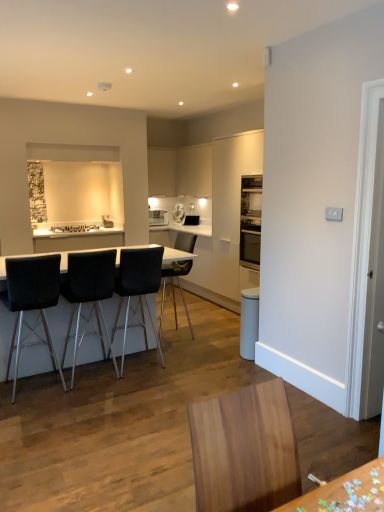
Question: Does black leather chair at center, placed as the 2th chair when sorted from right to left, have a greater width compared to black fabric chair at left, which is the first chair from left to right?

Choices:
 (A) yes
 (B) no

Answer: (B)

Question: Is black fabric chair at left, which is the first chair from left to right, at the back of black leather chair at center, the third chair positioned from the left?

Choices:
 (A) yes
 (B) no

Answer: (B)

Question: Is black leather chair at center, placed as the 2th chair when sorted from right to left, outside of black fabric chair at left, the fourth chair in the right-to-left sequence?

Choices:
 (A) yes
 (B) no

Answer: (A)

Question: Can you confirm if black leather chair at center, placed as the 2th chair when sorted from right to left, is smaller than black fabric chair at left, which is the first chair from left to right?

Choices:
 (A) yes
 (B) no

Answer: (A)

Question: Is black leather chair at center, the third chair positioned from the left, to the right of black fabric chair at left, which is the first chair from left to right, from the viewer's perspective?

Choices:
 (A) yes
 (B) no

Answer: (A)

Question: Is black leather chair at center, placed as the 2th chair when sorted from right to left, closer to camera compared to black fabric chair at left, which is the first chair from left to right?

Choices:
 (A) yes
 (B) no

Answer: (B)

Question: Is the position of black leather chair at center, which ranks as the 1th chair in right-to-left order, more distant than that of black fabric chair at left, which is the first chair from left to right?

Choices:
 (A) no
 (B) yes

Answer: (B)

Question: Considering the relative sizes of black leather chair at center, marked as the fourth chair in a left-to-right arrangement, and black fabric chair at left, which is the first chair from left to right, in the image provided, is black leather chair at center, marked as the fourth chair in a left-to-right arrangement, bigger than black fabric chair at left, which is the first chair from left to right,?

Choices:
 (A) no
 (B) yes

Answer: (A)

Question: Can you see black leather chair at center, marked as the fourth chair in a left-to-right arrangement, touching black fabric chair at left, the fourth chair in the right-to-left sequence?

Choices:
 (A) no
 (B) yes

Answer: (A)

Question: Does black leather chair at center, marked as the fourth chair in a left-to-right arrangement, have a greater width compared to black fabric chair at left, the fourth chair in the right-to-left sequence?

Choices:
 (A) no
 (B) yes

Answer: (A)

Question: From a real-world perspective, is black leather chair at center, marked as the fourth chair in a left-to-right arrangement, on black fabric chair at left, which is the first chair from left to right?

Choices:
 (A) no
 (B) yes

Answer: (A)

Question: From a real-world perspective, is black leather chair at center, which ranks as the 1th chair in right-to-left order, located beneath black fabric chair at left, the fourth chair in the right-to-left sequence?

Choices:
 (A) yes
 (B) no

Answer: (A)

Question: Is white glossy cabinet at upper center, which is the first cabinetry in right-to-left order, taller than black fabric chair at left, which is the first chair from left to right?

Choices:
 (A) yes
 (B) no

Answer: (B)